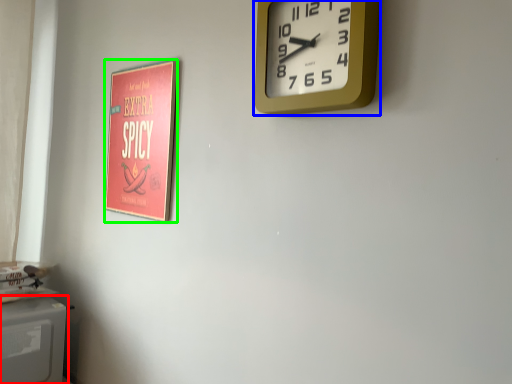
Question: Which object is the closest to the appliance (highlighted by a red box)? Choose among these: wall clock (highlighted by a blue box) or poster page (highlighted by a green box).

Choices:
 (A) wall clock
 (B) poster page

Answer: (B)